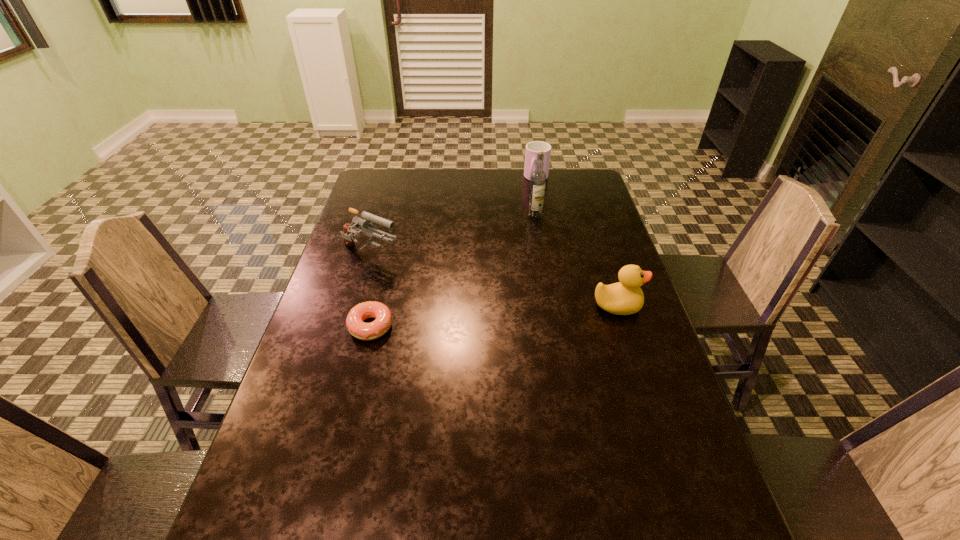
At what (x,y) coordinates should I click in order to perform the action: click on the shortest object. Please return your answer as a coordinate pair (x, y). This screenshot has width=960, height=540. Looking at the image, I should click on (364, 331).

Locate an element on the screen. The image size is (960, 540). duck is located at coordinates pyautogui.click(x=625, y=297).

Find the location of a particular element. the second farthest object is located at coordinates (538, 177).

Locate an element on the screen. This screenshot has width=960, height=540. vodka is located at coordinates (538, 177).

The height and width of the screenshot is (540, 960). In order to click on the third nearest object in this screenshot , I will do `click(366, 221)`.

The image size is (960, 540). What are the coordinates of `the farthest object` in the screenshot? It's located at (532, 148).

Find the location of a particular element. vacant space located on the front of the doughnut is located at coordinates (343, 444).

I want to click on vacant space situated 0.350m on the label of the tallest object, so click(491, 277).

Identify the location of vacant space situated 0.110m on the label of the tallest object. This screenshot has height=540, width=960. [520, 234].

You are a GUI agent. You are given a task and a screenshot of the screen. Output one action in this format:
    pyautogui.click(x=<x>, y=<y>)
    Task: Click on the free region located 0.260m on the label of the tallest object
    The height and width of the screenshot is (540, 960).
    Given the screenshot: What is the action you would take?
    pyautogui.click(x=503, y=260)